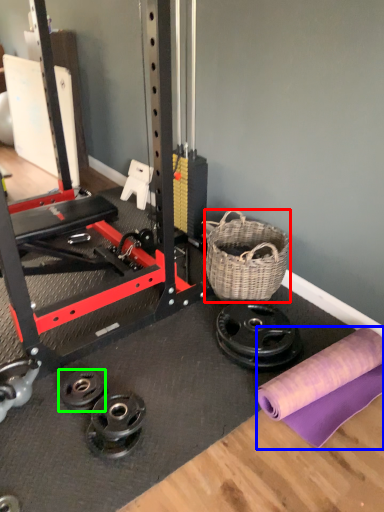
Question: Based on their relative distances, which object is nearer to basket (highlighted by a red box)? Choose from fabric (highlighted by a blue box) and wheel (highlighted by a green box).

Choices:
 (A) fabric
 (B) wheel

Answer: (A)